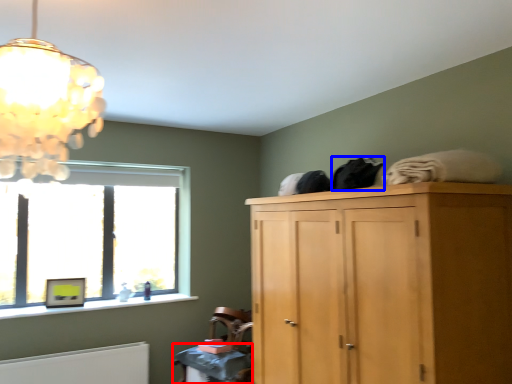
Question: Which object appears farthest to the camera in this image, table (highlighted by a red box) or clothing (highlighted by a blue box)?

Choices:
 (A) table
 (B) clothing

Answer: (A)